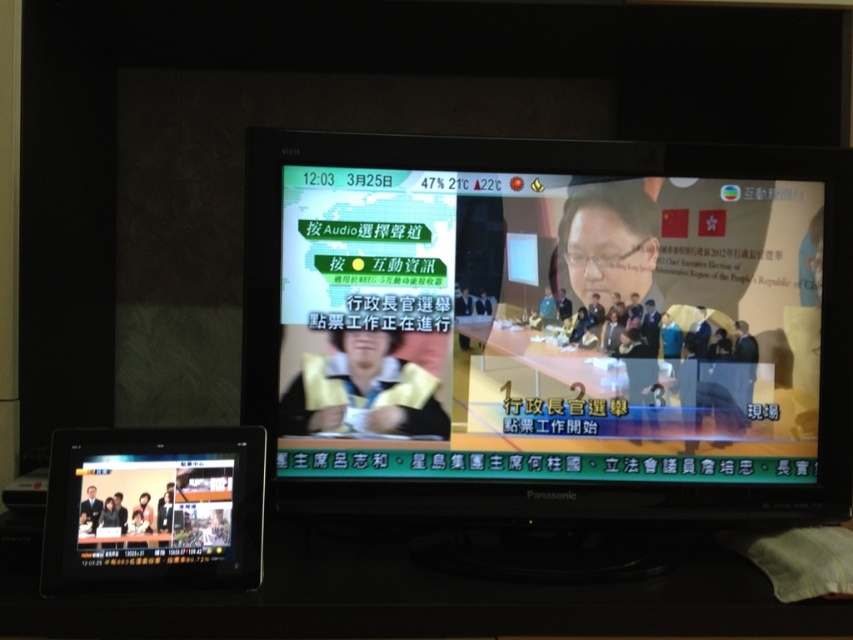
You are organizing a presentation and need to place a 12 inch wide laptop between the matte black monitor at center and the black glossy tablet at lower left. Can the laptop fit in the space between them?

The distance between the matte black monitor at center and the black glossy tablet at lower left is 13.27 inches. Since the laptop is 12 inches wide, there is enough space for it to fit between them.

You are a photographer adjusting your camera to capture the television screen and tablet setup. You need to focus on both the television screen and the tablet. Which point, point [410,355] or point [212,515], is closer to the camera lens?

Point [212,515] is closer to the camera lens than point [410,355] because the description states that point [410,355] is further away from the camera compared to point [212,515].